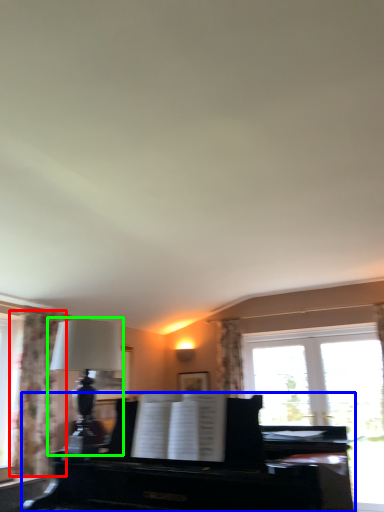
Question: Considering the real-world distances, which object is farthest from curtain (highlighted by a red box)? piano (highlighted by a blue box) or table lamp (highlighted by a green box)?

Choices:
 (A) piano
 (B) table lamp

Answer: (A)